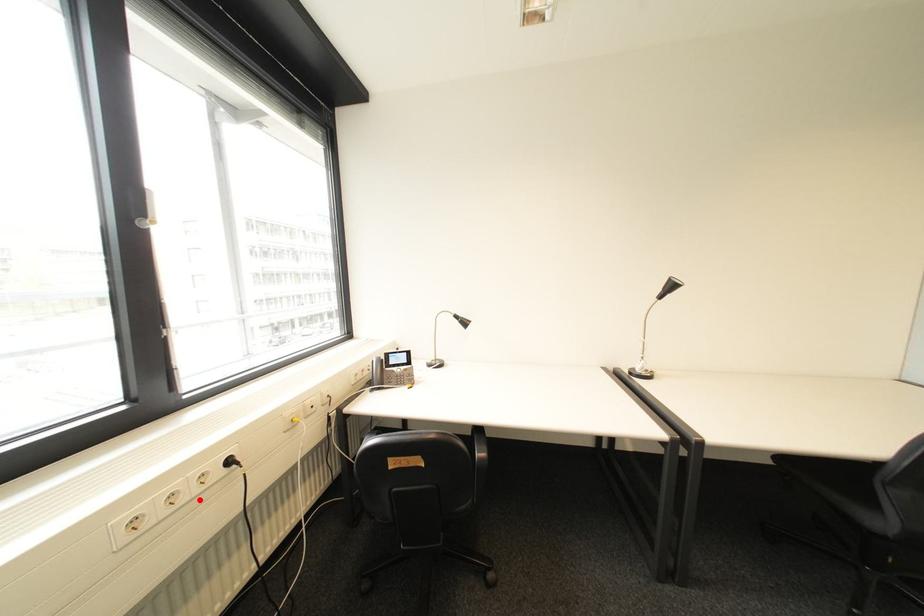
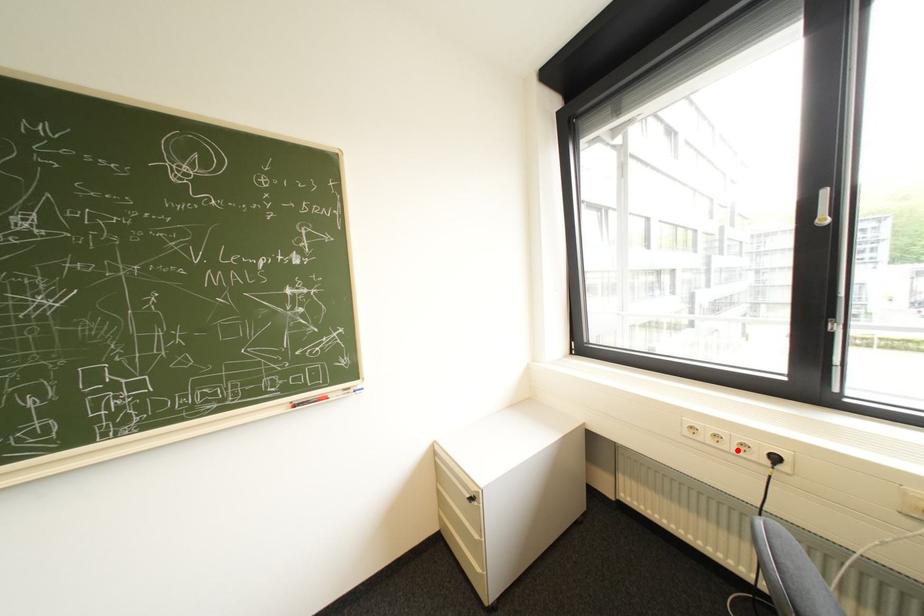
I am providing you with two images of the same scene from different viewpoints. A red point is marked on the first image and another point is marked on the second image. Is the red point in image1 aligned with the point shown in image2?

Yes